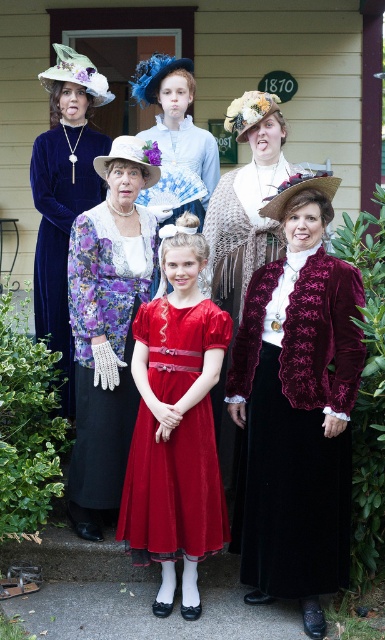
Between point (127, 248) and point (217, 525), which one is positioned behind?

Point (127, 248)

Describe the element at coordinates (108, 324) in the screenshot. The width and height of the screenshot is (385, 640). I see `velvet floral dress at center` at that location.

Where is `velvet floral dress at center`? The height and width of the screenshot is (640, 385). velvet floral dress at center is located at coordinates (108, 324).

Is velvet burgundy jacket at center to the right of velvet dress at upper left from the viewer's perspective?

Indeed, velvet burgundy jacket at center is positioned on the right side of velvet dress at upper left.

How much distance is there between velvet burgundy jacket at center and velvet dress at upper left?

velvet burgundy jacket at center and velvet dress at upper left are 1.53 meters apart from each other.

Who is more forward, (242, 524) or (83, 54)?

Positioned in front is point (242, 524).

This screenshot has height=640, width=385. I want to click on velvet burgundy jacket at center, so click(x=296, y=410).

Does velvet floral dress at center appear over velvet dress at upper left?

No.

Does velvet floral dress at center have a larger size compared to velvet dress at upper left?

Actually, velvet floral dress at center might be smaller than velvet dress at upper left.

Find the location of a particular element. velvet floral dress at center is located at coordinates (108, 324).